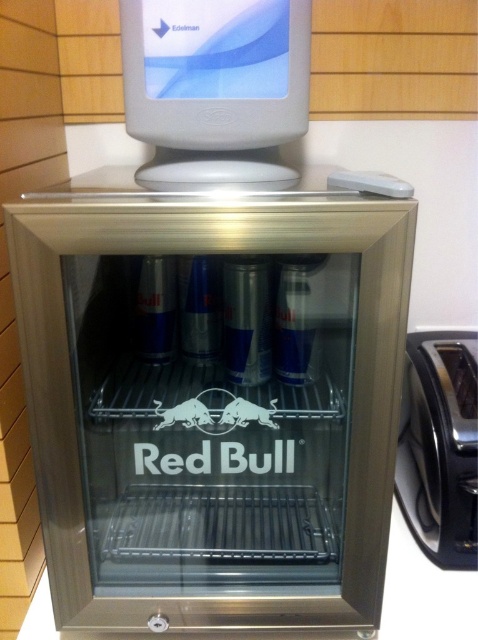
You are standing in front of the Red Bull refrigerator and want to check both the white plastic monitor at upper center and the satin chrome toaster at lower right. Which object is positioned higher up?

The white plastic monitor at upper center is positioned higher up than the satin chrome toaster at lower right.

You are an interior designer planning to place a new decorative item between the satin silver fridge at center and the white plastic monitor at upper center. Given their sizes, which object should you place the item closer to to ensure it fits within the available space?

The satin silver fridge at center is wider than the white plastic monitor at upper center. To ensure the decorative item fits within the available space, place it closer to the white plastic monitor at upper center since there is more space between them due to the fridge being wider.

You are standing in front of a Red Bull refrigerator. There is a point marked at coordinates (x=214, y=397). Which object does this point correspond to?

The point at coordinates (x=214, y=397) corresponds to the satin silver fridge at center.